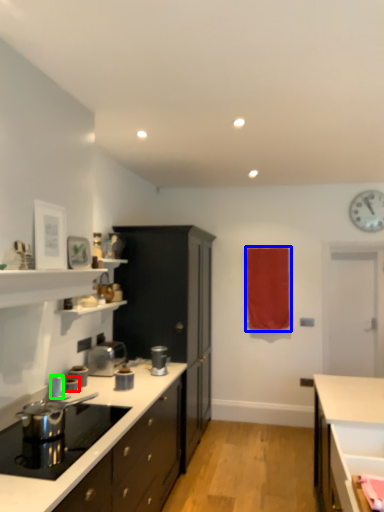
Question: Which object is the closest to the kitchen appliance (highlighted by a red box)? Choose among these: curtain (highlighted by a blue box) or kitchen appliance (highlighted by a green box).

Choices:
 (A) curtain
 (B) kitchen appliance

Answer: (B)